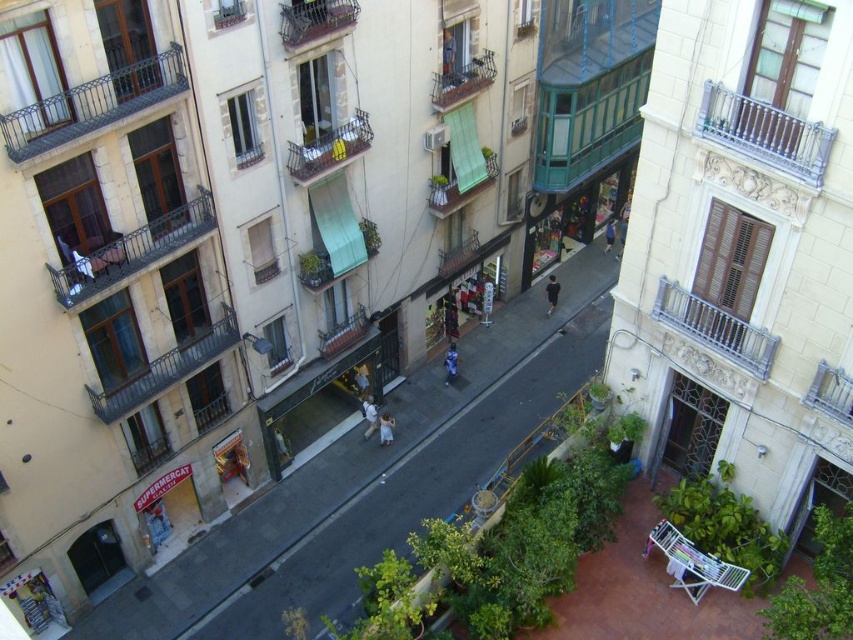
Can you confirm if metallic balcony at upper center is shorter than light blue jeans at lower left?

Correct, metallic balcony at upper center is not as tall as light blue jeans at lower left.

At what (x,y) coordinates should I click in order to perform the action: click on metallic balcony at upper center. Please return your answer as a coordinate pair (x, y). Looking at the image, I should click on (314, 19).

Which is in front, point (314, 19) or point (157, 529)?

Positioned in front is point (314, 19).

This screenshot has height=640, width=853. Identify the location of metallic balcony at upper center. (314, 19).

Which is above, metallic silver balcony at right or light blue denim jeans at center?

Positioned higher is metallic silver balcony at right.

Is metallic silver balcony at right thinner than light blue denim jeans at center?

No, metallic silver balcony at right is not thinner than light blue denim jeans at center.

What do you see at coordinates (715, 326) in the screenshot? This screenshot has width=853, height=640. I see `metallic silver balcony at right` at bounding box center [715, 326].

Find the location of a particular element. metallic silver balcony at right is located at coordinates (715, 326).

Locate an element on the screen. light blue jeans at lower left is located at coordinates (155, 524).

Is point (146, 529) positioned before point (610, 244)?

Yes, it is.

Find the location of `light blue jeans at lower left`. light blue jeans at lower left is located at coordinates (155, 524).